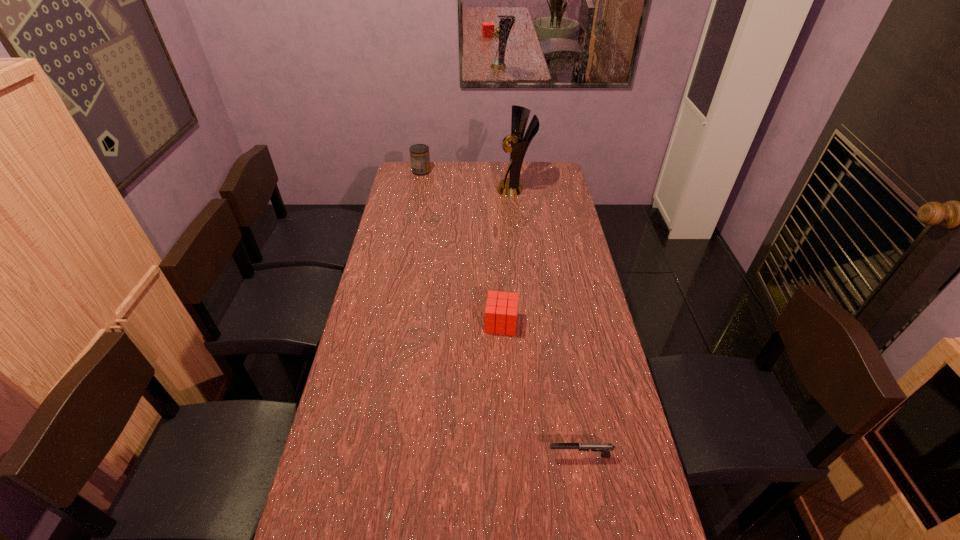
The image size is (960, 540). Identify the location of gun that is at the right edge. (605, 448).

Find the location of a particular element. The height and width of the screenshot is (540, 960). object present at the far left corner is located at coordinates coord(419,153).

Find the location of a particular element. object located in the far right corner section of the desktop is located at coordinates (510, 187).

Image resolution: width=960 pixels, height=540 pixels. In order to click on vacant area at the left edge of the desktop in this screenshot , I will do `click(374, 308)`.

This screenshot has height=540, width=960. Find the location of `blank space at the right edge of the desktop`. blank space at the right edge of the desktop is located at coordinates (609, 484).

Find the location of a particular element. This screenshot has height=540, width=960. free space at the far right corner of the desktop is located at coordinates (542, 167).

This screenshot has height=540, width=960. Find the location of `vacant area between the shortest object and the tallest object`. vacant area between the shortest object and the tallest object is located at coordinates (548, 322).

You are a GUI agent. You are given a task and a screenshot of the screen. Output one action in this format:
    pyautogui.click(x=<x>, y=<y>)
    Task: Click on the free space between the third shortest object and the award
    The width and height of the screenshot is (960, 540).
    Given the screenshot: What is the action you would take?
    pyautogui.click(x=468, y=180)

I want to click on empty space that is in between the can and the third farthest object, so click(x=462, y=247).

Where is `free spot between the award and the cube`? The height and width of the screenshot is (540, 960). free spot between the award and the cube is located at coordinates pos(508,256).